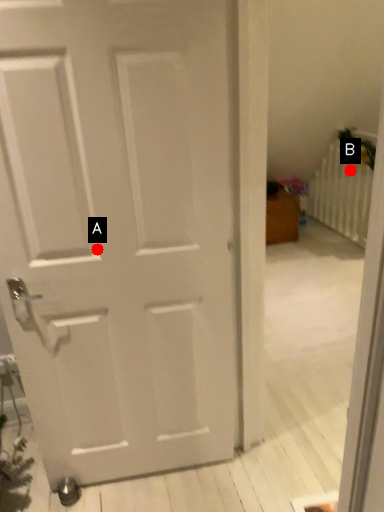
Question: Two points are circled on the image, labeled by A and B beside each circle. Which of the following is the closest to the observer?

Choices:
 (A) A is closer
 (B) B is closer

Answer: (A)